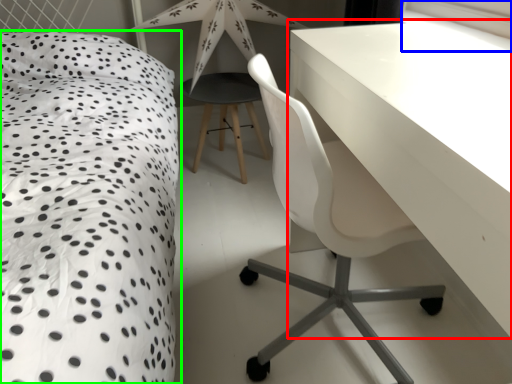
Question: Which object is the farthest from table (highlighted by a red box)? Choose among these: window screen (highlighted by a blue box) or bed (highlighted by a green box).

Choices:
 (A) window screen
 (B) bed

Answer: (A)